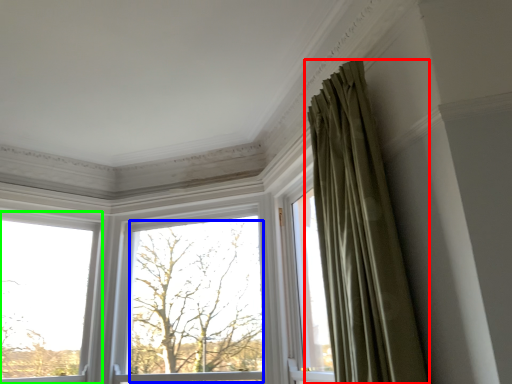
Question: Which object is the farthest from curtain (highlighted by a red box)? Choose among these: tree (highlighted by a blue box) or window (highlighted by a green box).

Choices:
 (A) tree
 (B) window

Answer: (B)